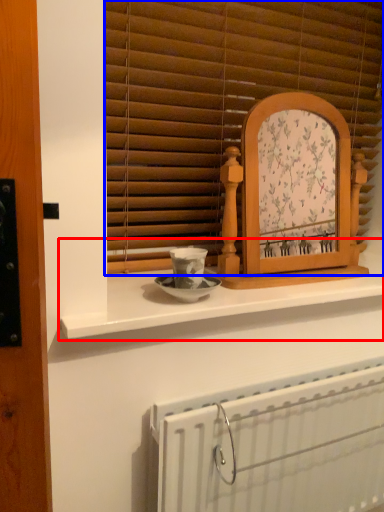
Question: Which object is further to the camera taking this photo, counter (highlighted by a red box) or window blind (highlighted by a blue box)?

Choices:
 (A) counter
 (B) window blind

Answer: (B)